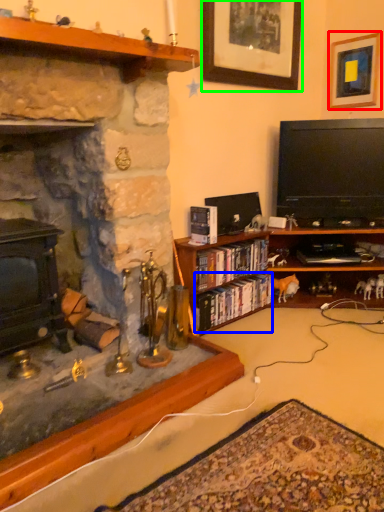
Question: Which object is positioned farthest from picture frame (highlighted by a red box)? Select from book (highlighted by a blue box) and picture frame (highlighted by a green box).

Choices:
 (A) book
 (B) picture frame

Answer: (A)